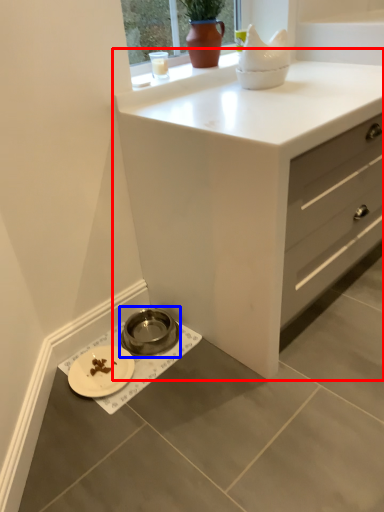
Question: Which point is closer to the camera, chest of drawers (highlighted by a red box) or appliance (highlighted by a blue box)?

Choices:
 (A) chest of drawers
 (B) appliance

Answer: (A)